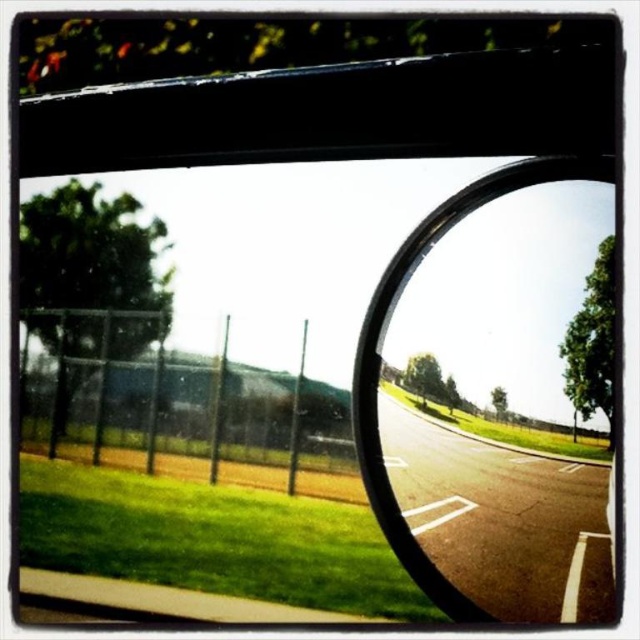
Does transparent glass car window at center have a lesser height compared to black rubber car mirror at center?

No, transparent glass car window at center is not shorter than black rubber car mirror at center.

Describe the element at coordinates (324, 394) in the screenshot. I see `transparent glass car window at center` at that location.

Where is `transparent glass car window at center`? transparent glass car window at center is located at coordinates (324, 394).